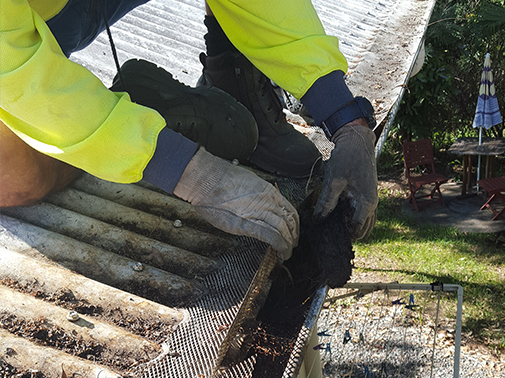
You are a GUI agent. You are given a task and a screenshot of the screen. Output one action in this format:
    pyautogui.click(x=<x>, y=<y>)
    Task: Click on the table
    This screenshot has width=505, height=378.
    Given the screenshot: What is the action you would take?
    pyautogui.click(x=483, y=152)